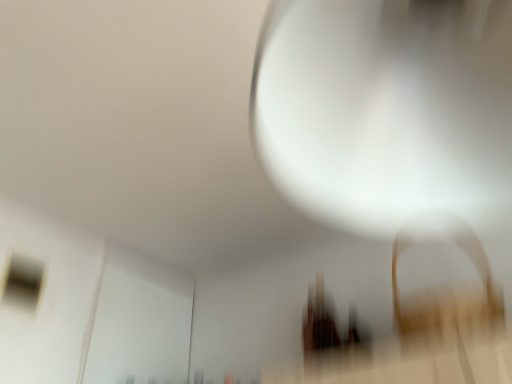
Question: Is matte glass window at upper left wider or thinner than white glossy light bulb at upper center?

Choices:
 (A) wide
 (B) thin

Answer: (B)

Question: Does point (19, 284) appear closer or farther from the camera than point (269, 57)?

Choices:
 (A) closer
 (B) farther

Answer: (B)

Question: Which is correct: matte glass window at upper left is inside white glossy light bulb at upper center, or outside of it?

Choices:
 (A) inside
 (B) outside

Answer: (B)

Question: From their relative heights in the image, would you say white glossy light bulb at upper center is taller or shorter than matte glass window at upper left?

Choices:
 (A) tall
 (B) short

Answer: (A)

Question: From a real-world perspective, is white glossy light bulb at upper center physically located above or below matte glass window at upper left?

Choices:
 (A) below
 (B) above

Answer: (A)

Question: Considering the relative positions of white glossy light bulb at upper center and matte glass window at upper left in the image provided, is white glossy light bulb at upper center to the left or to the right of matte glass window at upper left?

Choices:
 (A) right
 (B) left

Answer: (A)

Question: Is white glossy light bulb at upper center inside the boundaries of matte glass window at upper left, or outside?

Choices:
 (A) outside
 (B) inside

Answer: (A)